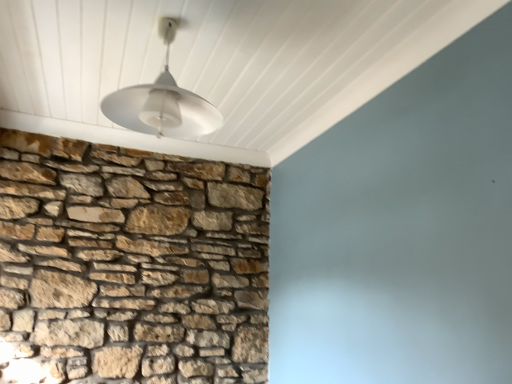
Question: Can you confirm if white matte lampshade at upper center is taller than natural stone wall at left?

Choices:
 (A) yes
 (B) no

Answer: (B)

Question: Could you tell me if white matte lampshade at upper center is facing natural stone wall at left?

Choices:
 (A) no
 (B) yes

Answer: (A)

Question: Considering the relative sizes of white matte lampshade at upper center and natural stone wall at left in the image provided, is white matte lampshade at upper center thinner than natural stone wall at left?

Choices:
 (A) yes
 (B) no

Answer: (B)

Question: From the image's perspective, is white matte lampshade at upper center located above natural stone wall at left?

Choices:
 (A) yes
 (B) no

Answer: (A)

Question: Can you confirm if white matte lampshade at upper center is wider than natural stone wall at left?

Choices:
 (A) yes
 (B) no

Answer: (A)

Question: From the image's perspective, is white matte lampshade at upper center under natural stone wall at left?

Choices:
 (A) no
 (B) yes

Answer: (A)

Question: From the image's perspective, is natural stone wall at left below white matte lampshade at upper center?

Choices:
 (A) no
 (B) yes

Answer: (B)

Question: Does natural stone wall at left contain white matte lampshade at upper center?

Choices:
 (A) no
 (B) yes

Answer: (A)

Question: Is natural stone wall at left located outside white matte lampshade at upper center?

Choices:
 (A) no
 (B) yes

Answer: (B)

Question: Is natural stone wall at left further to camera compared to white matte lampshade at upper center?

Choices:
 (A) no
 (B) yes

Answer: (B)

Question: Is natural stone wall at left to the left of white matte lampshade at upper center from the viewer's perspective?

Choices:
 (A) no
 (B) yes

Answer: (B)

Question: From a real-world perspective, is natural stone wall at left positioned over white matte lampshade at upper center based on gravity?

Choices:
 (A) yes
 (B) no

Answer: (B)

Question: Based on their sizes in the image, would you say natural stone wall at left is bigger or smaller than white matte lampshade at upper center?

Choices:
 (A) small
 (B) big

Answer: (B)